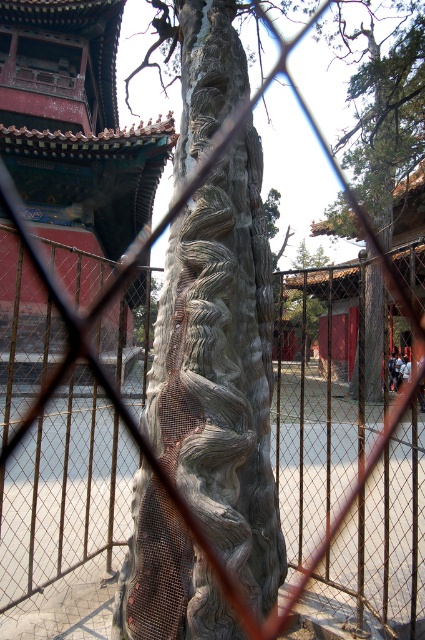
You are standing in front of a tree trunk with a chain link fence in front of you. You see a point marked at coordinates [74,124]. What is located at that point?

The matte red temple at upper left is located at point [74,124].

You are an artist sketching the scene through the fence. You notice the matte red temple at upper left and the gray textured bark at center. Which object would require more horizontal space on your paper to accurately depict its full width?

The matte red temple at upper left requires more horizontal space because its width surpasses that of the gray textured bark at center.

You are an architect analyzing the scene through the fence. You need to determine which object is taller between the gray textured stone at center and the matte red temple at upper left. Based on the scene, which one is taller?

The matte red temple at upper left is taller than the gray textured stone at center.